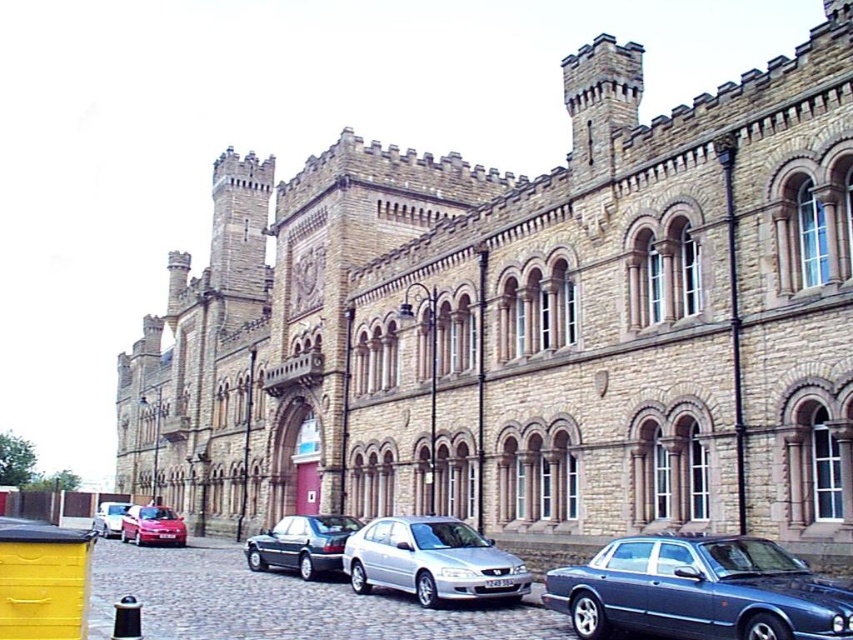
Question: Can you confirm if metallic blue sedan at lower right is positioned above shiny dark gray sedan at center?

Choices:
 (A) no
 (B) yes

Answer: (B)

Question: Which point appears closest to the camera in this image?

Choices:
 (A) (369, 531)
 (B) (102, 513)
 (C) (585, 570)

Answer: (C)

Question: Does silver metallic sedan at center have a lesser width compared to matte red car at lower left?

Choices:
 (A) yes
 (B) no

Answer: (A)

Question: Which object appears closest to the camera in this image?

Choices:
 (A) metallic blue sedan at lower right
 (B) silver metallic car at lower left

Answer: (A)

Question: Which of the following is the farthest from the observer?

Choices:
 (A) shiny dark gray sedan at center
 (B) silver metallic car at lower left
 (C) silver metallic sedan at center

Answer: (B)

Question: Does metallic blue sedan at lower right come in front of matte red car at lower left?

Choices:
 (A) no
 (B) yes

Answer: (B)